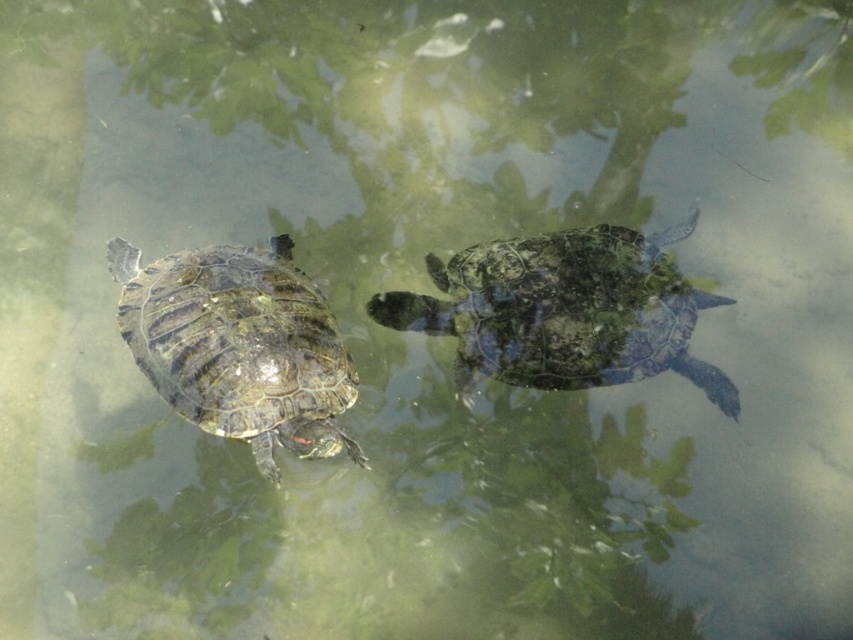
Measure the distance from textured greenish-brown tortoise at center to shiny green tortoise at left.

They are 11.89 inches apart.

Is textured greenish-brown tortoise at center wider than shiny green tortoise at left?

Correct, the width of textured greenish-brown tortoise at center exceeds that of shiny green tortoise at left.

Does point (479, 307) lie in front of point (312, 336)?

No, (479, 307) is further to viewer.

At what (x,y) coordinates should I click in order to perform the action: click on textured greenish-brown tortoise at center. Please return your answer as a coordinate pair (x, y). The width and height of the screenshot is (853, 640). Looking at the image, I should click on (566, 310).